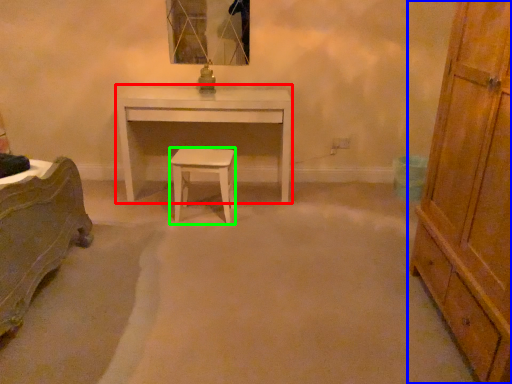
Question: Considering the real-world distances, which object is farthest from desk (highlighted by a red box)? chest of drawers (highlighted by a blue box) or stool (highlighted by a green box)?

Choices:
 (A) chest of drawers
 (B) stool

Answer: (A)